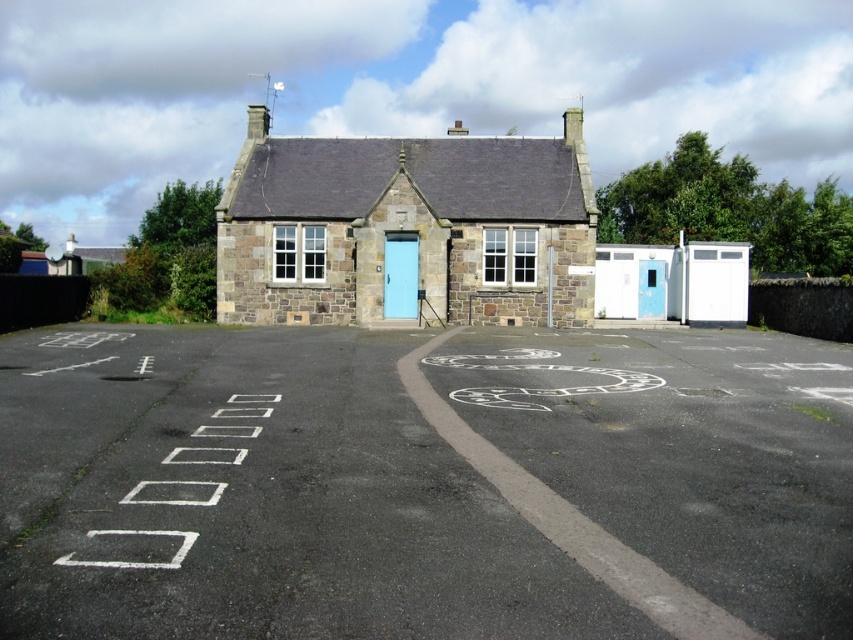
Consider the image. Between white asphalt parking lot at center and light blue wooden door at center, which one has less height?

With less height is white asphalt parking lot at center.

In the scene shown: Can you confirm if white asphalt parking lot at center is positioned below light blue wooden door at center?

Correct, white asphalt parking lot at center is located below light blue wooden door at center.

Is point (647, 573) closer to viewer compared to point (386, 246)?

Yes, it is in front of point (386, 246).

Where is `white asphalt parking lot at center`? The width and height of the screenshot is (853, 640). white asphalt parking lot at center is located at coordinates (422, 483).